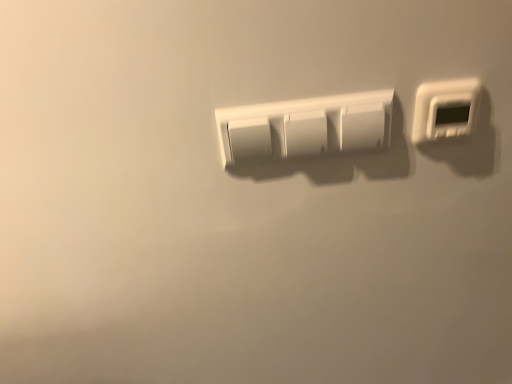
From the picture: How much space does white plastic thermostat at upper right, positioned as the first light switch in right-to-left order, occupy horizontally?

1.05 inches.

Locate an element on the screen. The height and width of the screenshot is (384, 512). white plastic thermostat at upper right, positioned as the first light switch in right-to-left order is located at coordinates (445, 109).

Describe the element at coordinates (445, 109) in the screenshot. The width and height of the screenshot is (512, 384). I see `white plastic thermostat at upper right, positioned as the first light switch in right-to-left order` at that location.

What is the approximate width of white matte light switch at center, the 2th light switch when ordered from right to left?

white matte light switch at center, the 2th light switch when ordered from right to left, is 0.90 inches wide.

What do you see at coordinates (305, 126) in the screenshot? I see `white matte light switch at center, the first light switch in the left-to-right sequence` at bounding box center [305, 126].

In the scene shown: In order to face white matte light switch at center, the first light switch in the left-to-right sequence, should I rotate leftwards or rightwards?

It's best to rotate right around 6.940 degrees.

The width and height of the screenshot is (512, 384). What are the coordinates of `white matte light switch at center, the 2th light switch when ordered from right to left` in the screenshot? It's located at (305, 126).

Locate an element on the screen. The height and width of the screenshot is (384, 512). white plastic thermostat at upper right, arranged as the second light switch when viewed from the left is located at coordinates (445, 109).

Is white plastic thermostat at upper right, arranged as the second light switch when viewed from the left, at the right side of white matte light switch at center, the 2th light switch when ordered from right to left?

Correct, you'll find white plastic thermostat at upper right, arranged as the second light switch when viewed from the left, to the right of white matte light switch at center, the 2th light switch when ordered from right to left.

Which is in front, white plastic thermostat at upper right, arranged as the second light switch when viewed from the left, or white matte light switch at center, the first light switch in the left-to-right sequence?

white plastic thermostat at upper right, arranged as the second light switch when viewed from the left.

Considering the points (419, 132) and (261, 107), which point is in front, point (419, 132) or point (261, 107)?

Point (261, 107)

From the image's perspective, is white plastic thermostat at upper right, positioned as the first light switch in right-to-left order, above or below white matte light switch at center, the 2th light switch when ordered from right to left?

white plastic thermostat at upper right, positioned as the first light switch in right-to-left order, is situated higher than white matte light switch at center, the 2th light switch when ordered from right to left, in the image.

From the picture: From a real-world perspective, is white plastic thermostat at upper right, positioned as the first light switch in right-to-left order, positioned above or below white matte light switch at center, the 2th light switch when ordered from right to left?

white plastic thermostat at upper right, positioned as the first light switch in right-to-left order, is above white matte light switch at center, the 2th light switch when ordered from right to left.

Is white plastic thermostat at upper right, arranged as the second light switch when viewed from the left, wider than white matte light switch at center, the first light switch in the left-to-right sequence?

Indeed, white plastic thermostat at upper right, arranged as the second light switch when viewed from the left, has a greater width compared to white matte light switch at center, the first light switch in the left-to-right sequence.

Can you confirm if white plastic thermostat at upper right, arranged as the second light switch when viewed from the left, is shorter than white matte light switch at center, the 2th light switch when ordered from right to left?

Yes, white plastic thermostat at upper right, arranged as the second light switch when viewed from the left, is shorter than white matte light switch at center, the 2th light switch when ordered from right to left.

Which of these two, white plastic thermostat at upper right, positioned as the first light switch in right-to-left order, or white matte light switch at center, the 2th light switch when ordered from right to left, is smaller?

white plastic thermostat at upper right, positioned as the first light switch in right-to-left order.

Do you think white plastic thermostat at upper right, arranged as the second light switch when viewed from the left, is within white matte light switch at center, the first light switch in the left-to-right sequence, or outside of it?

white plastic thermostat at upper right, arranged as the second light switch when viewed from the left, exists outside the volume of white matte light switch at center, the first light switch in the left-to-right sequence.

Consider the image. Would you consider white plastic thermostat at upper right, positioned as the first light switch in right-to-left order, to be distant from white matte light switch at center, the 2th light switch when ordered from right to left?

Actually, white plastic thermostat at upper right, positioned as the first light switch in right-to-left order, and white matte light switch at center, the 2th light switch when ordered from right to left, are a little close together.

Is white plastic thermostat at upper right, arranged as the second light switch when viewed from the left, oriented away from white matte light switch at center, the 2th light switch when ordered from right to left?

No, white plastic thermostat at upper right, arranged as the second light switch when viewed from the left,'s orientation is not away from white matte light switch at center, the 2th light switch when ordered from right to left.

What's the angular difference between white plastic thermostat at upper right, arranged as the second light switch when viewed from the left, and white matte light switch at center, the 2th light switch when ordered from right to left,'s facing directions?

0.00418 degrees separate the facing orientations of white plastic thermostat at upper right, arranged as the second light switch when viewed from the left, and white matte light switch at center, the 2th light switch when ordered from right to left.

The width and height of the screenshot is (512, 384). What are the coordinates of `light switch in front of the white matte light switch at center, the first light switch in the left-to-right sequence` in the screenshot? It's located at (445, 109).

Is white matte light switch at center, the first light switch in the left-to-right sequence, at the right side of white plastic thermostat at upper right, positioned as the first light switch in right-to-left order?

No, white matte light switch at center, the first light switch in the left-to-right sequence, is not to the right of white plastic thermostat at upper right, positioned as the first light switch in right-to-left order.

Which object is further away from the camera taking this photo, white matte light switch at center, the first light switch in the left-to-right sequence, or white plastic thermostat at upper right, arranged as the second light switch when viewed from the left?

white matte light switch at center, the first light switch in the left-to-right sequence, is more distant.

Is point (260, 116) closer or farther from the camera than point (460, 131)?

Point (260, 116) appears to be closer to the viewer than point (460, 131).

From the image's perspective, who appears lower, white matte light switch at center, the 2th light switch when ordered from right to left, or white plastic thermostat at upper right, arranged as the second light switch when viewed from the left?

white matte light switch at center, the 2th light switch when ordered from right to left, appears lower in the image.

From a real-world perspective, who is located higher, white matte light switch at center, the 2th light switch when ordered from right to left, or white plastic thermostat at upper right, arranged as the second light switch when viewed from the left?

white plastic thermostat at upper right, arranged as the second light switch when viewed from the left, is physically above.

Considering the sizes of objects white matte light switch at center, the 2th light switch when ordered from right to left, and white plastic thermostat at upper right, arranged as the second light switch when viewed from the left, in the image provided, who is wider, white matte light switch at center, the 2th light switch when ordered from right to left, or white plastic thermostat at upper right, arranged as the second light switch when viewed from the left,?

white plastic thermostat at upper right, arranged as the second light switch when viewed from the left, is wider.

Is white matte light switch at center, the first light switch in the left-to-right sequence, taller or shorter than white plastic thermostat at upper right, arranged as the second light switch when viewed from the left?

Clearly, white matte light switch at center, the first light switch in the left-to-right sequence, is taller compared to white plastic thermostat at upper right, arranged as the second light switch when viewed from the left.

Considering the sizes of objects white matte light switch at center, the 2th light switch when ordered from right to left, and white plastic thermostat at upper right, arranged as the second light switch when viewed from the left, in the image provided, who is bigger, white matte light switch at center, the 2th light switch when ordered from right to left, or white plastic thermostat at upper right, arranged as the second light switch when viewed from the left,?

With larger size is white matte light switch at center, the 2th light switch when ordered from right to left.

Is white matte light switch at center, the 2th light switch when ordered from right to left, surrounding white plastic thermostat at upper right, positioned as the first light switch in right-to-left order?

No, white plastic thermostat at upper right, positioned as the first light switch in right-to-left order, is not a part of white matte light switch at center, the 2th light switch when ordered from right to left.

Is there a large distance between white matte light switch at center, the first light switch in the left-to-right sequence, and white plastic thermostat at upper right, positioned as the first light switch in right-to-left order?

Actually, white matte light switch at center, the first light switch in the left-to-right sequence, and white plastic thermostat at upper right, positioned as the first light switch in right-to-left order, are a little close together.

Is white matte light switch at center, the 2th light switch when ordered from right to left, turned away from white plastic thermostat at upper right, arranged as the second light switch when viewed from the left?

white matte light switch at center, the 2th light switch when ordered from right to left, does not have its back to white plastic thermostat at upper right, arranged as the second light switch when viewed from the left.

The width and height of the screenshot is (512, 384). I want to click on light switch that is behind the white plastic thermostat at upper right, positioned as the first light switch in right-to-left order, so click(x=305, y=126).

Locate an element on the screen. light switch lying behind the white plastic thermostat at upper right, arranged as the second light switch when viewed from the left is located at coordinates (305, 126).

Where is `light switch lying on the left of white plastic thermostat at upper right, positioned as the first light switch in right-to-left order`? This screenshot has width=512, height=384. light switch lying on the left of white plastic thermostat at upper right, positioned as the first light switch in right-to-left order is located at coordinates (305, 126).